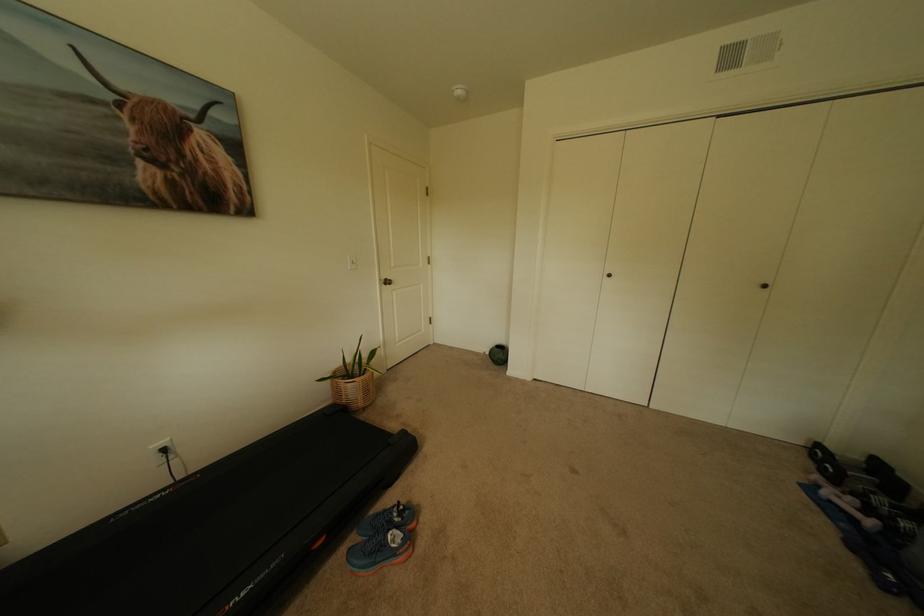
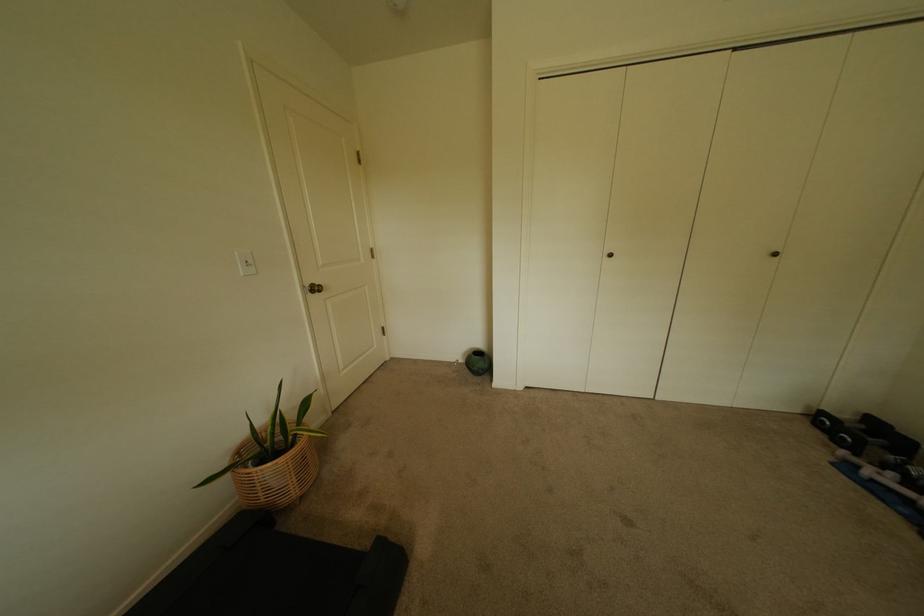
Where in the second image is the point corresponding to pixel 391 280 from the first image?

(315, 286)